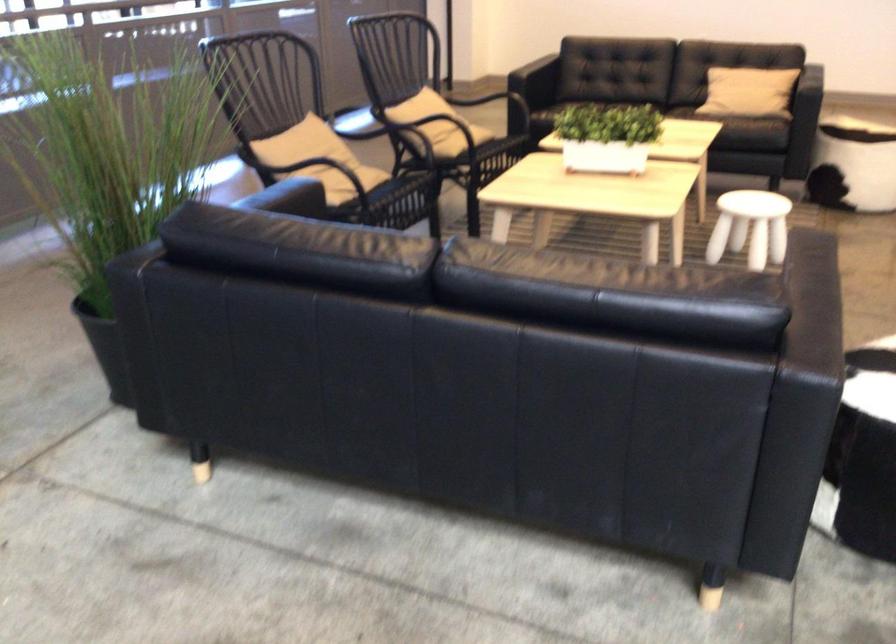
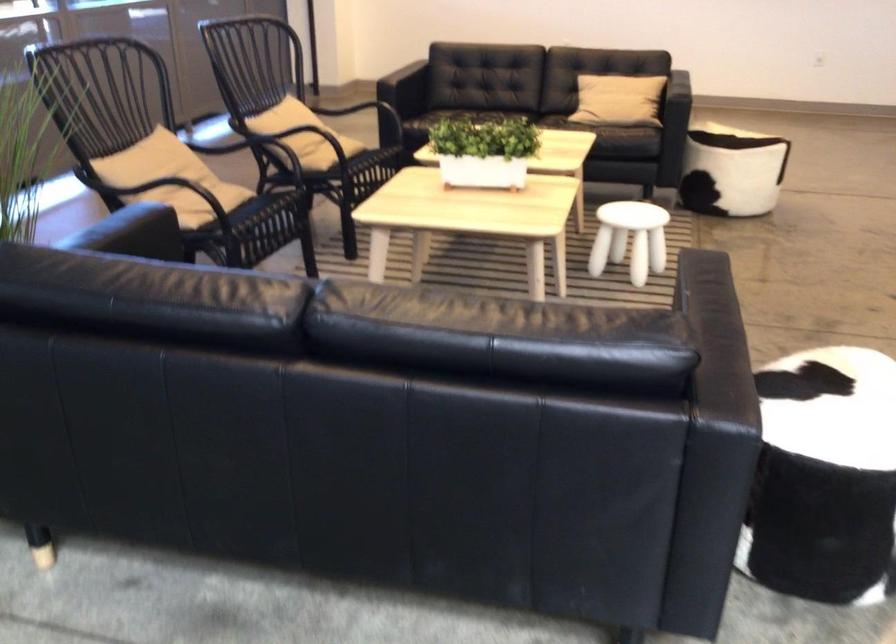
Question: The first image is from the beginning of the video and the second image is from the end. How did the camera likely rotate when shooting the video?

Choices:
 (A) Left
 (B) Right
 (C) Up
 (D) Down

Answer: (B)